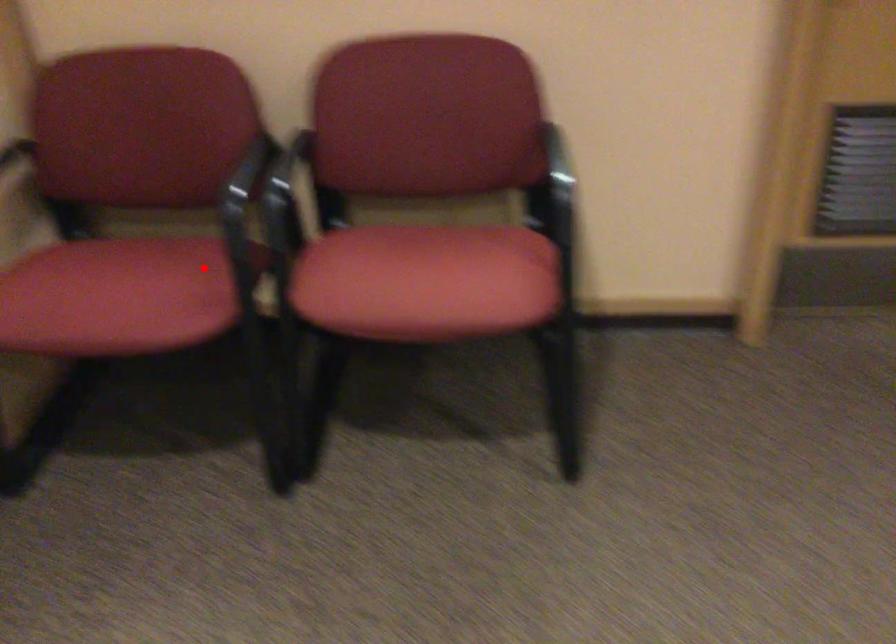
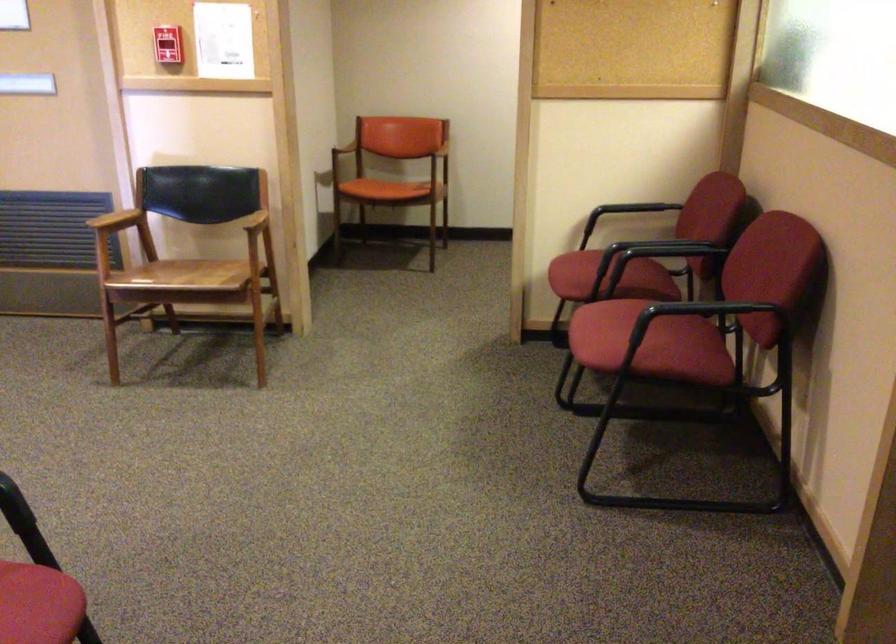
Find the pixel in the second image that matches the highlighted location in the first image.

(608, 278)